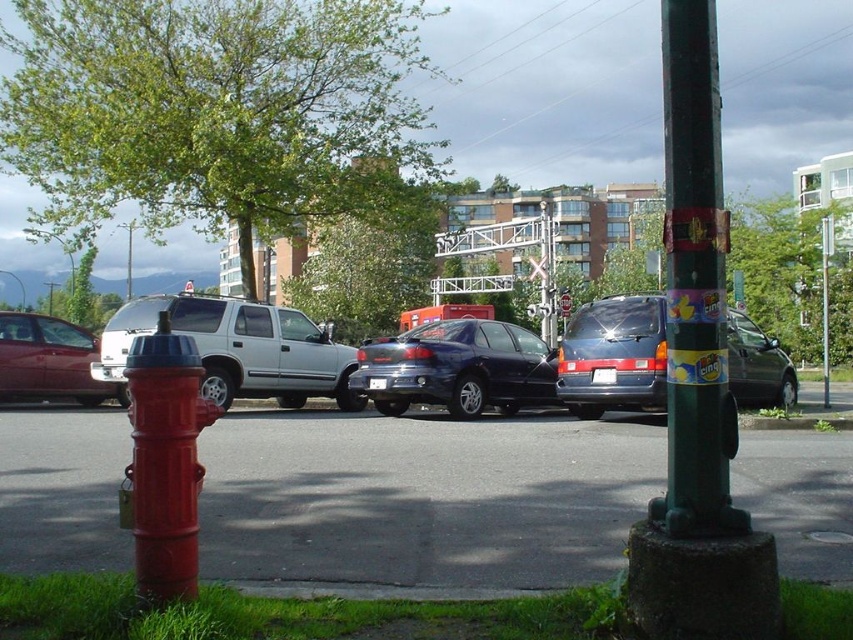
Does metallic silver suv at center have a lesser height compared to shiny black sedan at center?

Yes, metallic silver suv at center is shorter than shiny black sedan at center.

Is metallic silver suv at center bigger than shiny black sedan at center?

Actually, metallic silver suv at center might be smaller than shiny black sedan at center.

This screenshot has height=640, width=853. I want to click on metallic silver suv at center, so click(238, 348).

Which is more to the right, shiny red fire hydrant at lower left or brushed metal fire hydrant at lower left?

shiny red fire hydrant at lower left is more to the right.

Between shiny red fire hydrant at lower left and brushed metal fire hydrant at lower left, which one appears on the left side from the viewer's perspective?

From the viewer's perspective, brushed metal fire hydrant at lower left appears more on the left side.

Describe the element at coordinates (164, 461) in the screenshot. I see `shiny red fire hydrant at lower left` at that location.

This screenshot has height=640, width=853. Find the location of `shiny red fire hydrant at lower left`. shiny red fire hydrant at lower left is located at coordinates (164, 461).

Which is in front, point (170, 348) or point (543, 403)?

Point (170, 348) is in front.

Is shiny red fire hydrant at lower left to the left of shiny black sedan at center from the viewer's perspective?

Yes, shiny red fire hydrant at lower left is to the left of shiny black sedan at center.

Is point (160, 522) positioned after point (479, 401)?

No, (160, 522) is closer to viewer.

You are a GUI agent. You are given a task and a screenshot of the screen. Output one action in this format:
    pyautogui.click(x=<x>, y=<y>)
    Task: Click on the shiny red fire hydrant at lower left
    The image size is (853, 640).
    Given the screenshot: What is the action you would take?
    pyautogui.click(x=164, y=461)